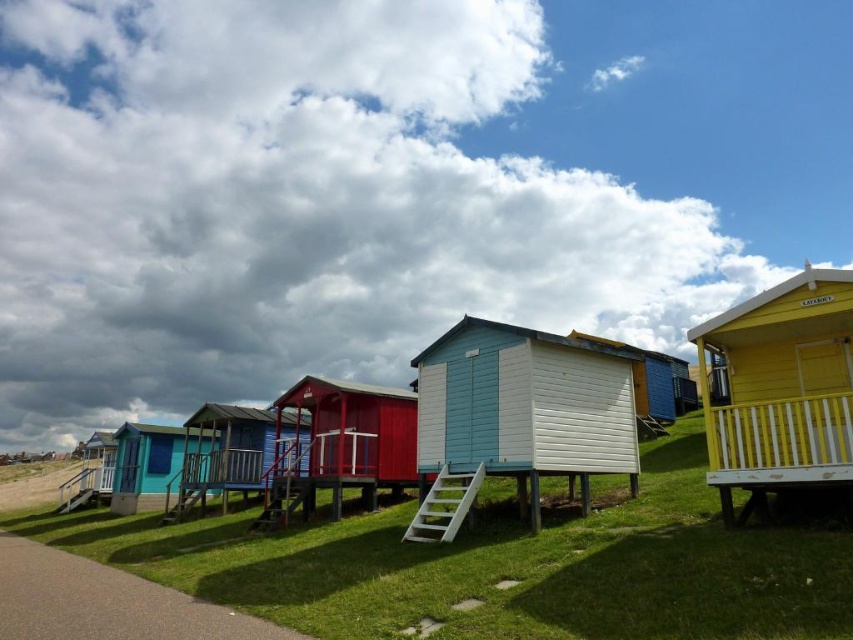
Question: Which point is closer to the camera?

Choices:
 (A) light blue wooden beach hut at center
 (B) matte red cabin at center
 (C) matte blue wooden hut at center
 (D) yellow painted wood beach hut at right

Answer: (D)

Question: Which of the following is the farthest from the observer?

Choices:
 (A) (216, 420)
 (B) (821, 452)

Answer: (A)

Question: Is light blue wooden beach hut at center to the left of matte red cabin at center from the viewer's perspective?

Choices:
 (A) no
 (B) yes

Answer: (A)

Question: From the image, what is the correct spatial relationship of yellow painted wood beach hut at right in relation to matte red cabin at center?

Choices:
 (A) right
 (B) left

Answer: (A)

Question: Which object appears closest to the camera in this image?

Choices:
 (A) light blue wooden beach hut at center
 (B) matte red cabin at center
 (C) matte blue wooden hut at center

Answer: (A)

Question: Is matte blue cabin at center further to the viewer compared to matte blue wooden hut at center?

Choices:
 (A) yes
 (B) no

Answer: (B)